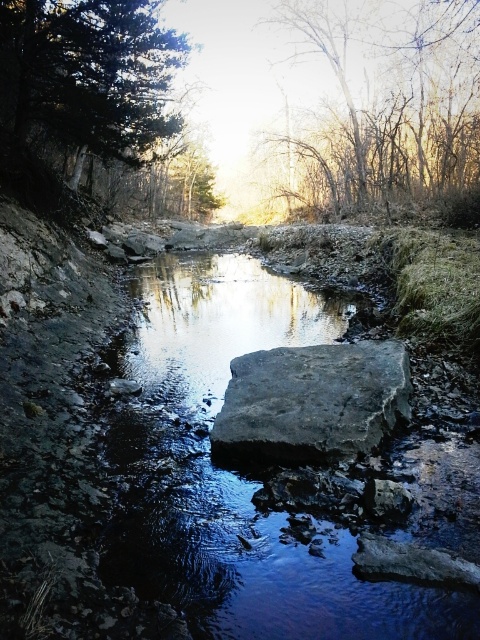
Identify the location of smooth stone stream at center. (232, 474).

Between smooth stone stream at center and dark green textured tree trunk at upper left, which one appears on the left side from the viewer's perspective?

dark green textured tree trunk at upper left

The image size is (480, 640). In order to click on smooth stone stream at center in this screenshot , I will do `click(232, 474)`.

Does dark green textured tree trunk at upper left come in front of smooth bark trees at upper center?

Yes, dark green textured tree trunk at upper left is in front of smooth bark trees at upper center.

Between point (19, 72) and point (415, 122), which one is positioned behind?

The point (415, 122) is behind.

At what (x,y) coordinates should I click in order to perform the action: click on dark green textured tree trunk at upper left. Please return your answer as a coordinate pair (x, y). This screenshot has width=480, height=640. Looking at the image, I should click on (83, 84).

Measure the distance between smooth stone stream at center and camera.

They are 7.82 feet apart.

Identify the location of smooth stone stream at center. The height and width of the screenshot is (640, 480). (232, 474).